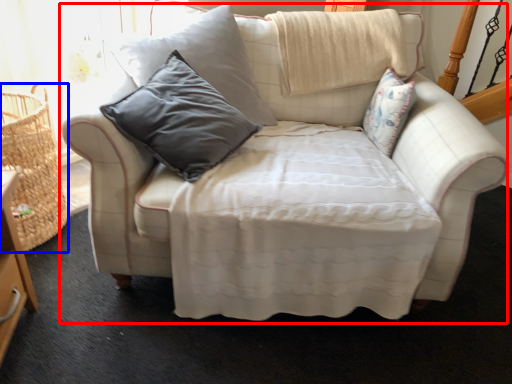
Question: Which of the following is the closest to the observer, studio couch (highlighted by a red box) or basket (highlighted by a blue box)?

Choices:
 (A) studio couch
 (B) basket

Answer: (A)